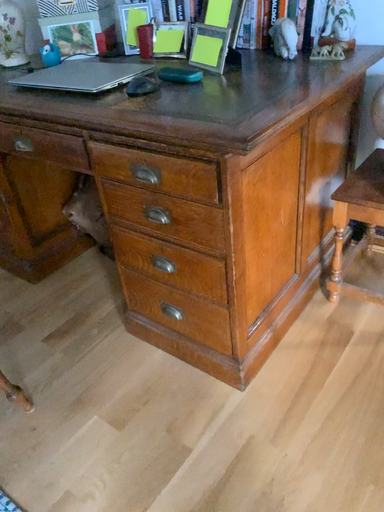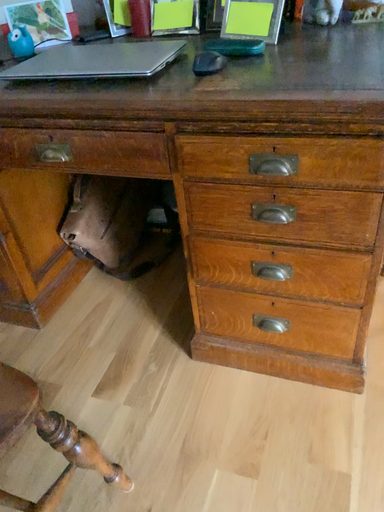
Question: How did the camera likely rotate when shooting the video?

Choices:
 (A) rotated right
 (B) rotated left

Answer: (A)